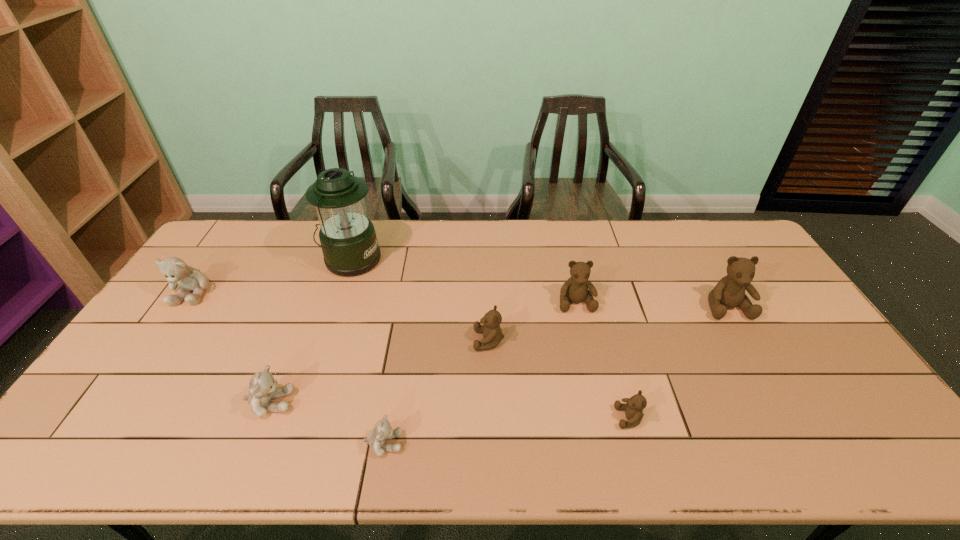
Find the location of a particular element. The image size is (960, 540). the tallest object is located at coordinates tap(348, 239).

Identify the location of green lantern. (348, 239).

Locate an element on the screen. The height and width of the screenshot is (540, 960). the tallest teddy bear is located at coordinates (729, 292).

This screenshot has height=540, width=960. I want to click on the rightmost object, so click(x=729, y=292).

This screenshot has width=960, height=540. What are the coordinates of `the third smallest brown teddy bear` in the screenshot? It's located at (575, 289).

Identify the location of the leftmost gray teddy bear. The width and height of the screenshot is (960, 540). (177, 272).

Image resolution: width=960 pixels, height=540 pixels. I want to click on the farthest gray teddy bear, so click(177, 272).

Where is `the fifth farthest object`? Image resolution: width=960 pixels, height=540 pixels. the fifth farthest object is located at coordinates (492, 334).

Locate an element on the screen. This screenshot has width=960, height=540. the fourth nearest teddy bear is located at coordinates (492, 334).

Image resolution: width=960 pixels, height=540 pixels. What are the coordinates of `the second teddy bear from left to right` in the screenshot? It's located at (263, 388).